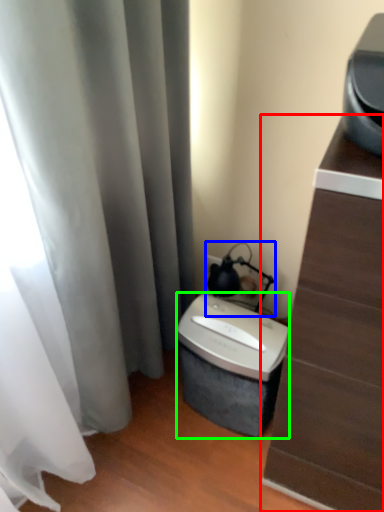
Question: Estimate the real-world distances between objects in this image. Which object is closer to furniture (highlighted by a red box), table lamp (highlighted by a blue box) or appliance (highlighted by a green box)?

Choices:
 (A) table lamp
 (B) appliance

Answer: (B)